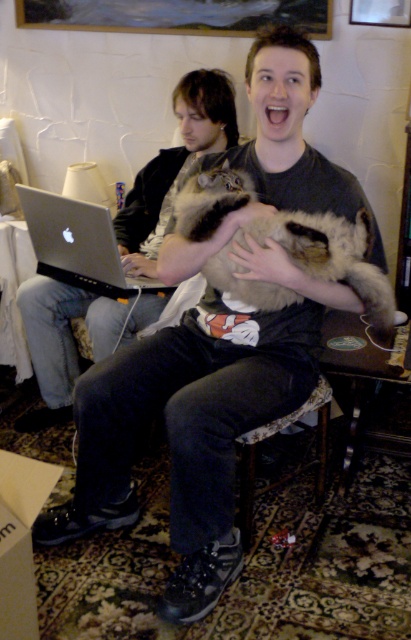
You are organizing a tech event and need to place two laptops on a shelf. The shelf has limited vertical space. You have the matte black laptop at left and the silver metallic laptop at left. Which laptop should you choose to fit better in the vertical space?

The silver metallic laptop at left should be chosen because it is shorter than the matte black laptop at left, making it better suited for limited vertical space.

You are a delivery person who needs to place a package on the surface between the matte black laptop at left and the fuzzy fur cat at center. The package is 20 cm wide. Can the package fit between them?

A: The matte black laptop at left is larger in size than the fuzzy fur cat at center. However, the exact distance between them is not provided. Without knowing the space between the two objects, it is impossible to determine if the package will fit.